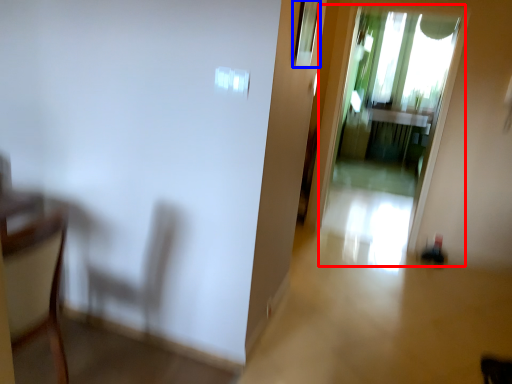
Question: Which of the following is the farthest to the observer, screen door (highlighted by a red box) or window (highlighted by a blue box)?

Choices:
 (A) screen door
 (B) window

Answer: (A)